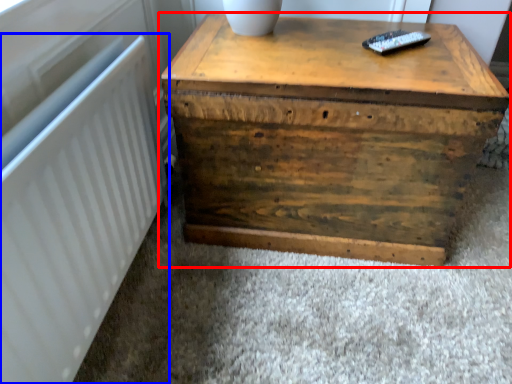
Question: Which of the following is the closest to the observer, table (highlighted by a red box) or radiator (highlighted by a blue box)?

Choices:
 (A) table
 (B) radiator

Answer: (B)